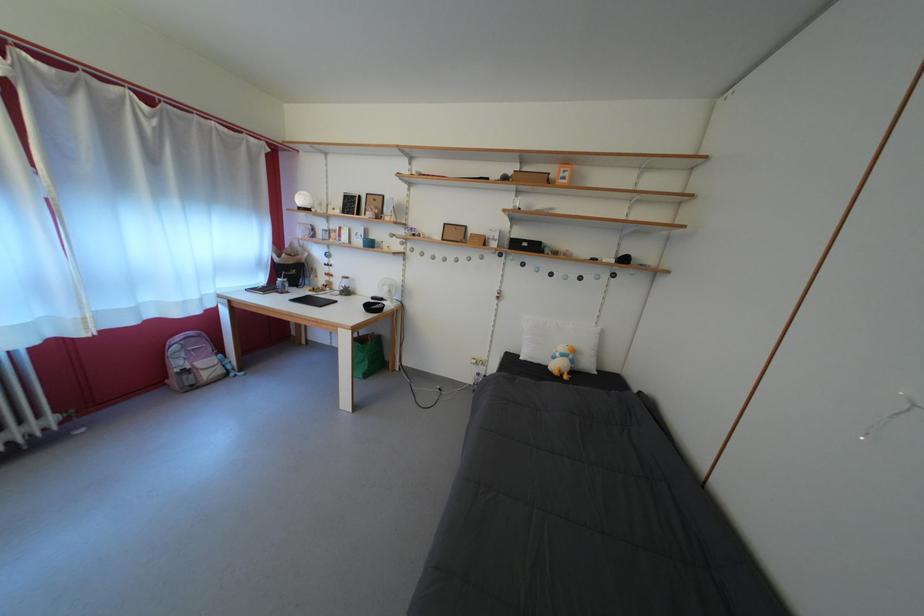
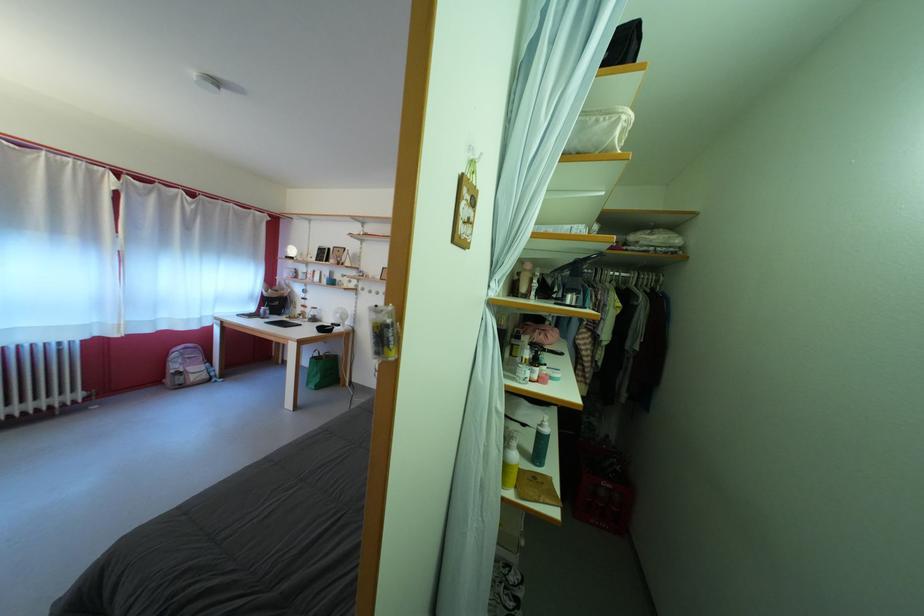
In the second image, find the point that corresponds to [187,370] in the first image.

(184, 373)